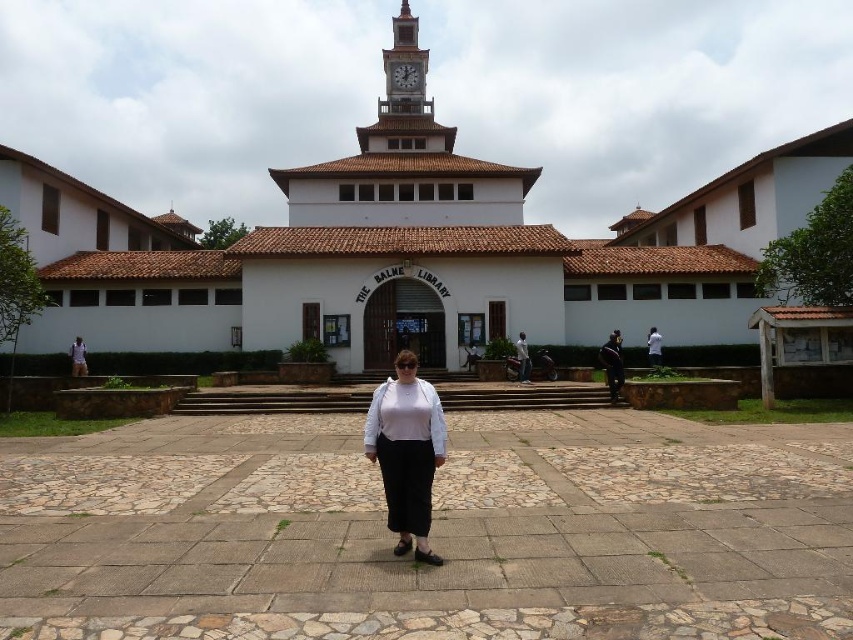
Question: Can you confirm if black fabric at center is wider than matte white shirt at center?

Choices:
 (A) no
 (B) yes

Answer: (A)

Question: Which object is positioned closest to the matte white shirt at lower left?

Choices:
 (A) white shirt at center
 (B) gray stone clock at upper center
 (C) matte white shirt at center

Answer: (C)

Question: Where is brown wooden clock tower at upper center located in relation to white shirt at center in the image?

Choices:
 (A) right
 (B) left

Answer: (B)

Question: Which object is positioned closest to the white shirt at center?

Choices:
 (A) matte white shirt at lower left
 (B) white matte shirt at center
 (C) matte white shirt at center
 (D) brown wooden clock tower at upper center

Answer: (C)

Question: Which point is closer to the camera?

Choices:
 (A) brown wooden clock tower at upper center
 (B) gray stone clock at upper center
 (C) matte white shirt at center
 (D) black fabric at center

Answer: (C)

Question: Can you confirm if gray stone clock at upper center is bigger than matte white shirt at lower left?

Choices:
 (A) no
 (B) yes

Answer: (A)